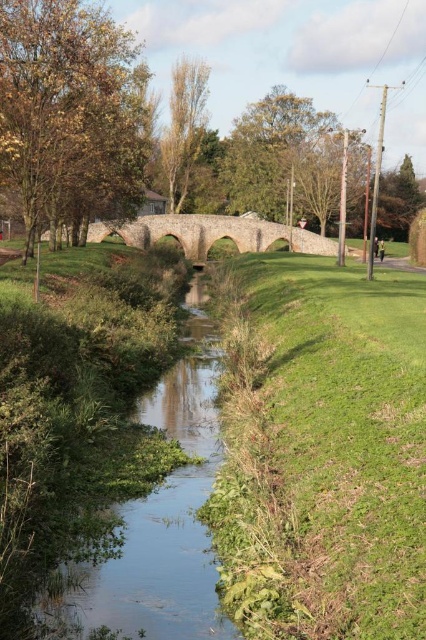
Question: Among these objects, which one is farthest from the camera?

Choices:
 (A) green grassy stream at center
 (B) green grass at center

Answer: (A)

Question: Can you confirm if green grass at center is positioned below green grassy stream at center?

Choices:
 (A) yes
 (B) no

Answer: (B)

Question: Which point is farther to the camera?

Choices:
 (A) (154, 614)
 (B) (305, 298)

Answer: (B)

Question: Where is green grass at center located in relation to green grassy stream at center in the image?

Choices:
 (A) right
 (B) left

Answer: (A)

Question: Is green grass at center to the right of green grassy stream at center from the viewer's perspective?

Choices:
 (A) yes
 (B) no

Answer: (A)